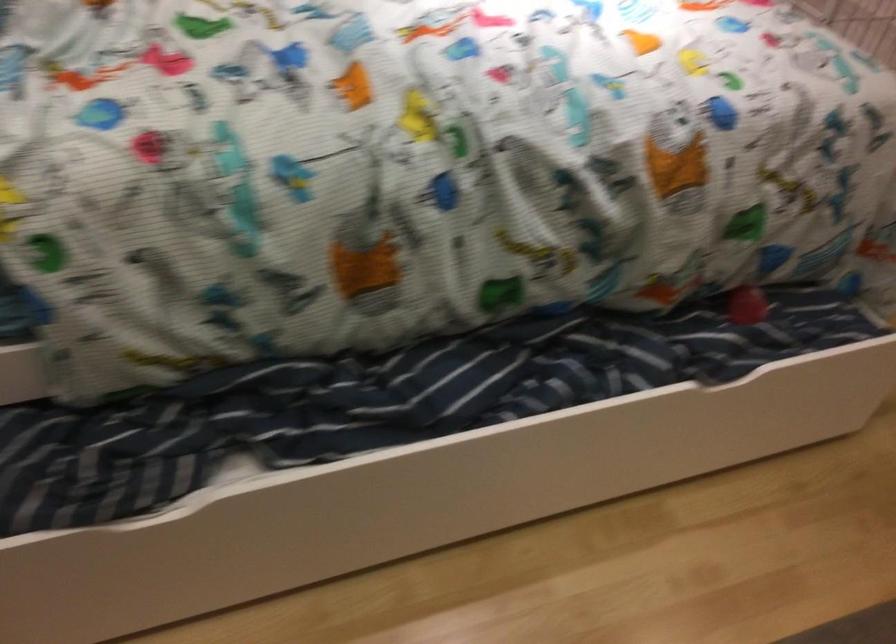
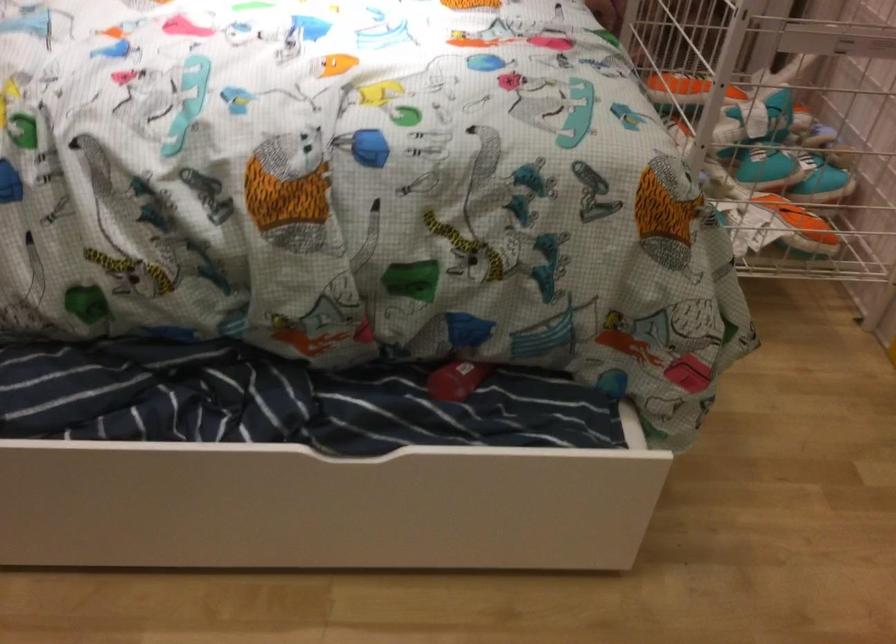
Question: What movement of the cameraman would produce the second image?

Choices:
 (A) Left
 (B) Right
 (C) Forward
 (D) Backward

Answer: (B)